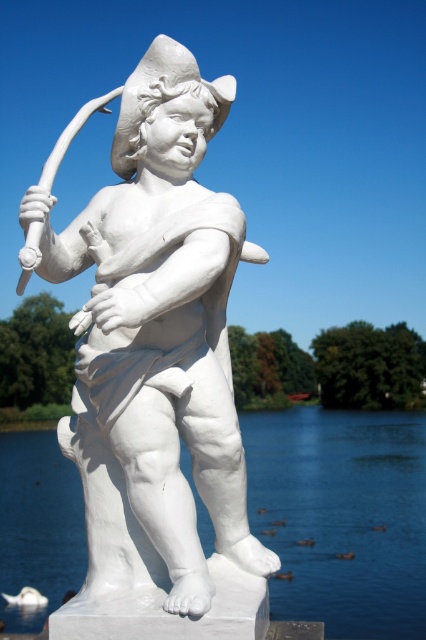
Question: Can you confirm if white marble statue at center is bigger than transparent water at statue right?

Choices:
 (A) no
 (B) yes

Answer: (A)

Question: Which point is closer to the camera?

Choices:
 (A) click(x=287, y=545)
 (B) click(x=115, y=372)

Answer: (B)

Question: Which point is closer to the camera taking this photo?

Choices:
 (A) (46, 506)
 (B) (209, 310)

Answer: (B)

Question: Which of the following is the farthest from the observer?

Choices:
 (A) (193, 384)
 (B) (9, 474)

Answer: (B)

Question: Considering the relative positions of white marble statue at center and transparent water at statue right in the image provided, where is white marble statue at center located with respect to transparent water at statue right?

Choices:
 (A) left
 (B) right

Answer: (A)

Question: From the image, what is the correct spatial relationship of white marble statue at center in relation to transparent water at statue right?

Choices:
 (A) right
 (B) left

Answer: (B)